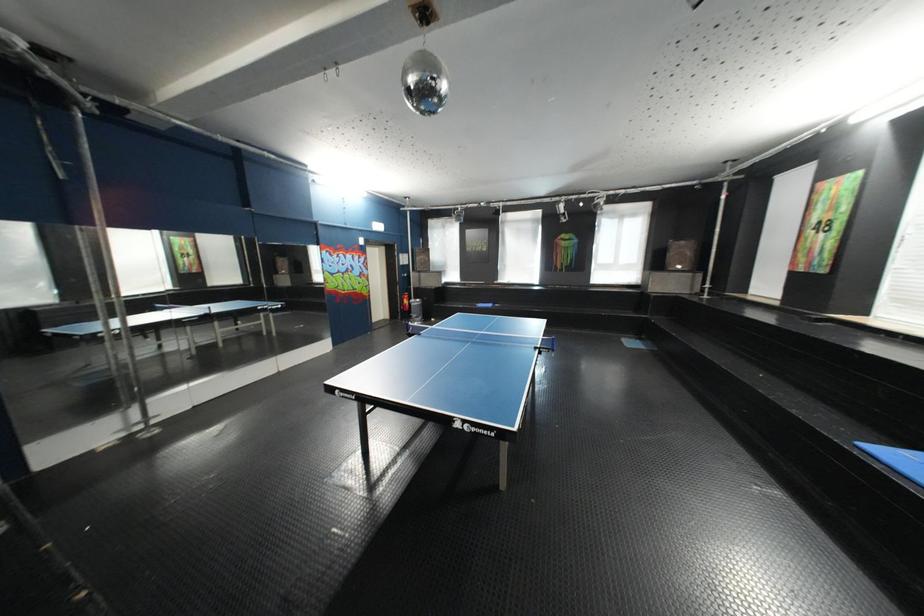
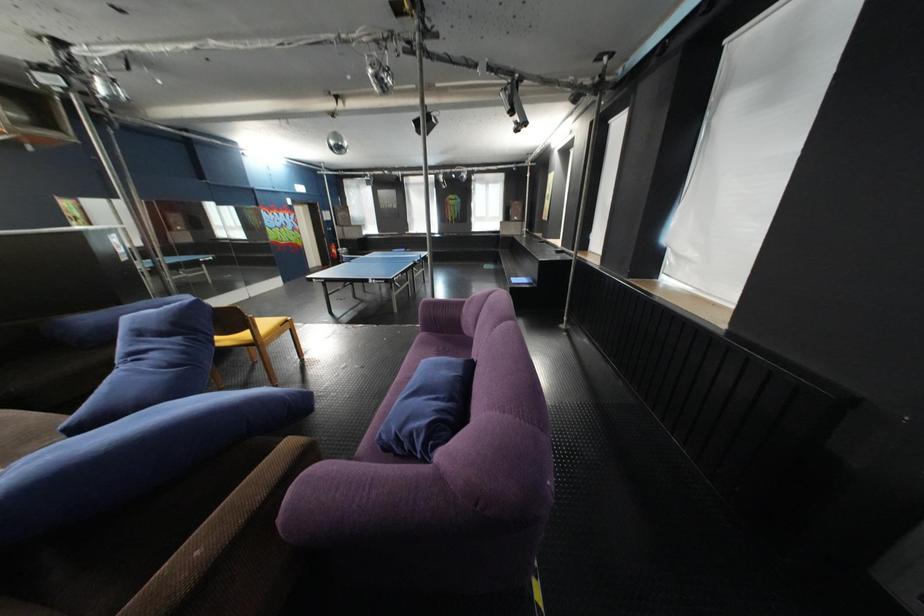
Question: The images are taken continuously from a first-person perspective. In which direction are you moving?

Choices:
 (A) Left
 (B) Right
 (C) Forward
 (D) Backward

Answer: (D)